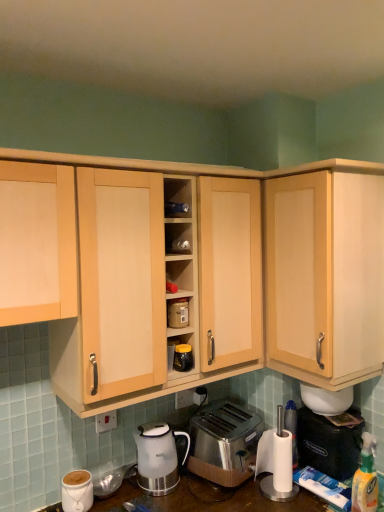
Question: Does white plastic electric outlet at lower center, marked as the second electric outlet in a back-to-front arrangement, have a larger size compared to matte white coffee cup at lower left?

Choices:
 (A) no
 (B) yes

Answer: (A)

Question: From a real-world perspective, is white plastic electric outlet at lower center, marked as the 2th electric outlet in a right-to-left arrangement, positioned over matte white coffee cup at lower left based on gravity?

Choices:
 (A) no
 (B) yes

Answer: (B)

Question: Is white plastic electric outlet at lower center, the first electric outlet in the front-to-back sequence, wider than matte white coffee cup at lower left?

Choices:
 (A) no
 (B) yes

Answer: (A)

Question: Is white plastic electric outlet at lower center, the first electric outlet in the front-to-back sequence, closer to the viewer compared to matte white coffee cup at lower left?

Choices:
 (A) no
 (B) yes

Answer: (A)

Question: From a real-world perspective, is white plastic electric outlet at lower center, marked as the second electric outlet in a back-to-front arrangement, located beneath matte white coffee cup at lower left?

Choices:
 (A) yes
 (B) no

Answer: (B)

Question: Choose the correct answer: Is light wood cabinet at upper right, placed as the 3th cabinetry when sorted from left to right, inside white plastic bottle at lower right, the second bottle in the right-to-left sequence, or outside it?

Choices:
 (A) inside
 (B) outside

Answer: (B)

Question: From the image's perspective, relative to white plastic bottle at lower right, the second bottle in the front-to-back sequence, is light wood cabinet at upper right, placed as the 3th cabinetry when sorted from left to right, above or below?

Choices:
 (A) below
 (B) above

Answer: (B)

Question: Is light wood cabinet at upper right, placed as the 3th cabinetry when sorted from left to right, in front of or behind white plastic bottle at lower right, the second bottle in the front-to-back sequence, in the image?

Choices:
 (A) behind
 (B) front

Answer: (B)

Question: Considering the positions of light wood cabinet at upper right, placed as the 3th cabinetry when sorted from left to right, and white plastic bottle at lower right, the 1th bottle in the back-to-front sequence, in the image, is light wood cabinet at upper right, placed as the 3th cabinetry when sorted from left to right, taller or shorter than white plastic bottle at lower right, the 1th bottle in the back-to-front sequence,?

Choices:
 (A) short
 (B) tall

Answer: (B)

Question: Relative to white plastic electric outlet at lower center, marked as the 2th electric outlet in a right-to-left arrangement, is satin white kettle at lower center in front or behind?

Choices:
 (A) front
 (B) behind

Answer: (A)

Question: Which is correct: satin white kettle at lower center is inside white plastic electric outlet at lower center, marked as the 2th electric outlet in a right-to-left arrangement, or outside of it?

Choices:
 (A) outside
 (B) inside

Answer: (A)

Question: In terms of width, does satin white kettle at lower center look wider or thinner when compared to white plastic electric outlet at lower center, marked as the 2th electric outlet in a right-to-left arrangement?

Choices:
 (A) wide
 (B) thin

Answer: (A)

Question: Based on their positions, is satin white kettle at lower center located to the left or right of white plastic electric outlet at lower center, marked as the second electric outlet in a back-to-front arrangement?

Choices:
 (A) right
 (B) left

Answer: (A)

Question: Considering the relative positions of satin white kettle at lower center and matte plastic container at center in the image provided, is satin white kettle at lower center to the left or to the right of matte plastic container at center?

Choices:
 (A) left
 (B) right

Answer: (A)

Question: From a real-world perspective, is satin white kettle at lower center positioned above or below matte plastic container at center?

Choices:
 (A) below
 (B) above

Answer: (A)